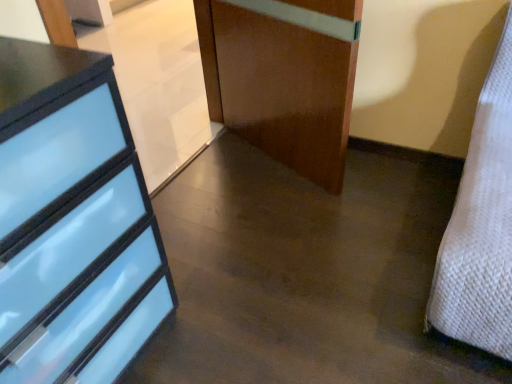
Where is `free point to the right of brown matte door at center`? The image size is (512, 384). free point to the right of brown matte door at center is located at coordinates (394, 179).